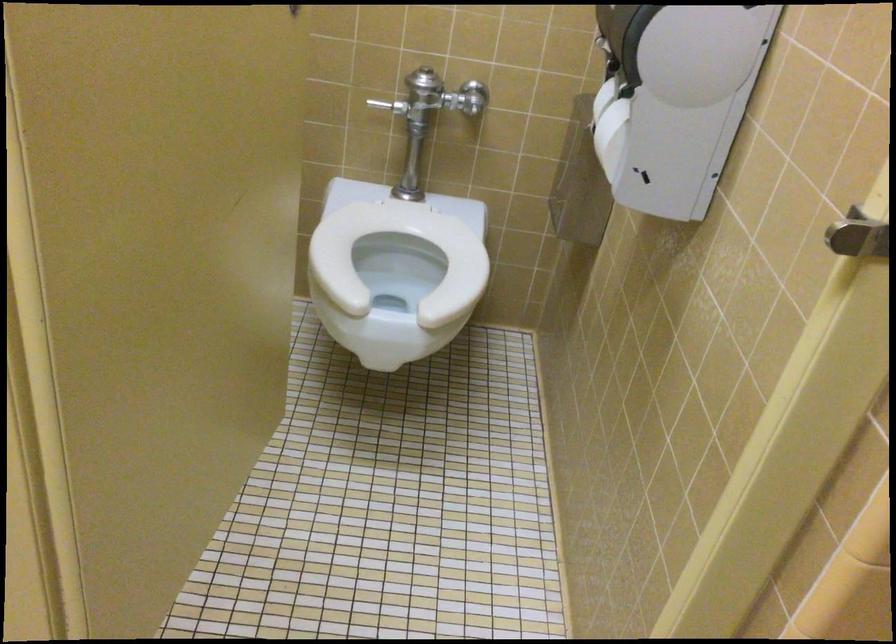
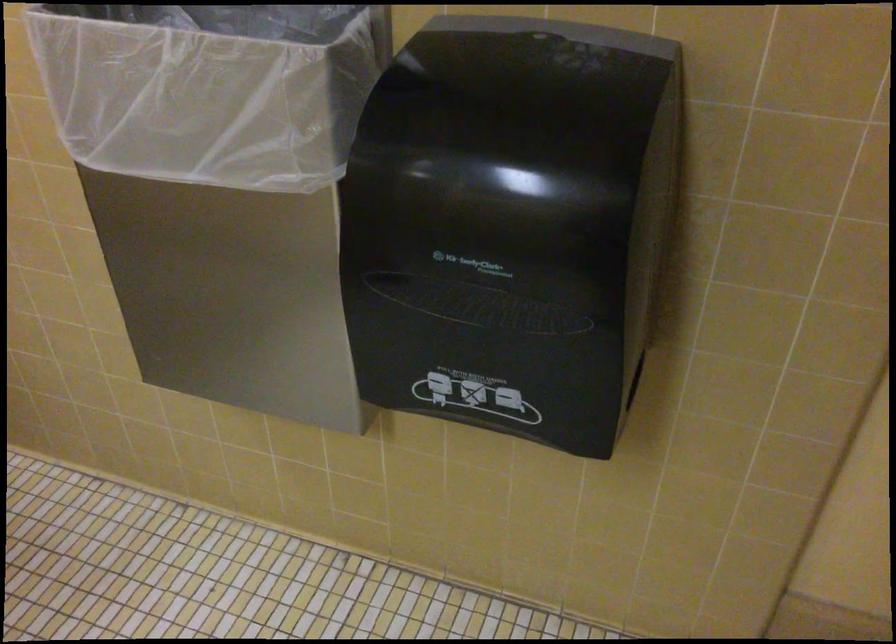
First-person continuous shooting, in which direction is the camera rotating?

The camera's rotation is toward right-down.